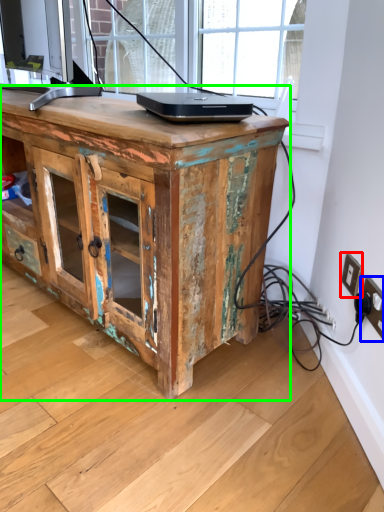
Question: Estimate the real-world distances between objects in this image. Which object is farther from electric outlet (highlighted by a red box), electric outlet (highlighted by a blue box) or desk (highlighted by a green box)?

Choices:
 (A) electric outlet
 (B) desk

Answer: (B)